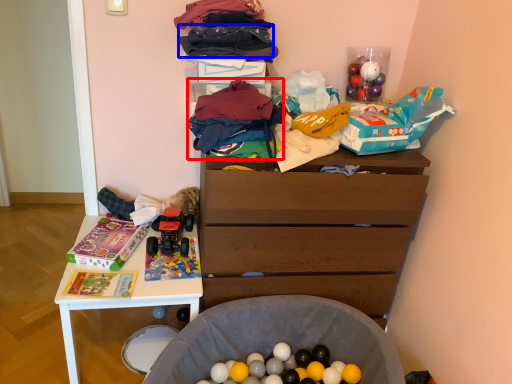
Question: Which of the following is the closest to the observer, clothing (highlighted by a red box) or clothing (highlighted by a blue box)?

Choices:
 (A) clothing
 (B) clothing

Answer: (A)